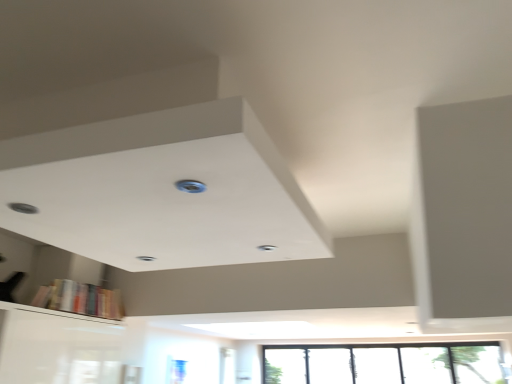
Image resolution: width=512 pixels, height=384 pixels. Find the location of `transparent glass window at lower right`. transparent glass window at lower right is located at coordinates (385, 363).

Identify the location of hardcover books at lower left. (80, 299).

You are a GUI agent. You are given a task and a screenshot of the screen. Output one action in this format:
    pyautogui.click(x=<x>, y=<y>)
    Task: Click on the blue plastic hole at center
    
    Given the screenshot: What is the action you would take?
    pyautogui.click(x=190, y=186)

In the scene shown: Is hardcover books at lower left in contact with blue plastic hole at center?

They are not placed beside each other.

From their relative heights in the image, would you say hardcover books at lower left is taller or shorter than blue plastic hole at center?

In the image, hardcover books at lower left appears to be taller than blue plastic hole at center.

Do you think hardcover books at lower left is within blue plastic hole at center, or outside of it?

hardcover books at lower left cannot be found inside blue plastic hole at center.

Find the location of a particular element. The image size is (512, 384). hole in front of the hardcover books at lower left is located at coordinates (190, 186).

From the image's perspective, which object appears higher, blue plastic hole at center or hardcover books at lower left?

blue plastic hole at center, from the image's perspective.

Between blue plastic hole at center and hardcover books at lower left, which one is positioned in front?

blue plastic hole at center.

From their relative heights in the image, would you say blue plastic hole at center is taller or shorter than hardcover books at lower left?

Considering their sizes, blue plastic hole at center has less height than hardcover books at lower left.

Is blue plastic hole at center not close to hardcover books at lower left?

Yes, blue plastic hole at center and hardcover books at lower left are located far from each other.

Are blue plastic hole at center and transparent glass window at lower right making contact?

No, blue plastic hole at center is not in contact with transparent glass window at lower right.

Does blue plastic hole at center have a greater width compared to transparent glass window at lower right?

Yes.

Is blue plastic hole at center positioned with its back to transparent glass window at lower right?

No, blue plastic hole at center is not facing the opposite direction of transparent glass window at lower right.

Which object is closer to the camera taking this photo, transparent glass window at lower right or hardcover books at lower left?

hardcover books at lower left is more forward.

Is there a large distance between transparent glass window at lower right and hardcover books at lower left?

That's right, there is a large distance between transparent glass window at lower right and hardcover books at lower left.

From the picture: Is transparent glass window at lower right spatially inside hardcover books at lower left, or outside of it?

transparent glass window at lower right exists outside the volume of hardcover books at lower left.

Which point is more distant from viewer, (369, 368) or (99, 310)?

The point (369, 368) is more distant.

Is hardcover books at lower left at the right side of transparent glass window at lower right?

No, hardcover books at lower left is not to the right of transparent glass window at lower right.

Can transparent glass window at lower right be found inside hardcover books at lower left?

No, hardcover books at lower left does not contain transparent glass window at lower right.

Find the location of `book above the transparent glass window at lower right (from the image's perspective)`. book above the transparent glass window at lower right (from the image's perspective) is located at coordinates (80, 299).

Considering the relative sizes of transparent glass window at lower right and blue plastic hole at center in the image provided, is transparent glass window at lower right taller than blue plastic hole at center?

Yes, transparent glass window at lower right is taller than blue plastic hole at center.

Based on the photo, which is nearer, (288, 372) or (193, 182)?

Clearly, point (288, 372) is more distant from the camera than point (193, 182).

Is transparent glass window at lower right thinner than blue plastic hole at center?

Yes, transparent glass window at lower right is thinner than blue plastic hole at center.

Consider the image. Is transparent glass window at lower right facing away from blue plastic hole at center?

No.

Locate an element on the screen. hole above the hardcover books at lower left (from the image's perspective) is located at coordinates (190, 186).

Where is `hole on the right of hardcover books at lower left`? This screenshot has height=384, width=512. hole on the right of hardcover books at lower left is located at coordinates (190, 186).

Looking at the image, which one is located further to blue plastic hole at center, transparent glass window at lower right or hardcover books at lower left?

Among the two, transparent glass window at lower right is located further to blue plastic hole at center.

Looking at this image, looking at the image, which one is located further to hardcover books at lower left, transparent glass window at lower right or blue plastic hole at center?

Based on the image, blue plastic hole at center appears to be further to hardcover books at lower left.

Estimate the real-world distances between objects in this image. Which object is closer to transparent glass window at lower right, blue plastic hole at center or hardcover books at lower left?

hardcover books at lower left is positioned closer to the anchor transparent glass window at lower right.

When comparing their distances from transparent glass window at lower right, does hardcover books at lower left or blue plastic hole at center seem further?

blue plastic hole at center is further to transparent glass window at lower right.

Estimate the real-world distances between objects in this image. Which object is further from hardcover books at lower left, blue plastic hole at center or transparent glass window at lower right?

The object further to hardcover books at lower left is blue plastic hole at center.

Consider the image. Estimate the real-world distances between objects in this image. Which object is closer to blue plastic hole at center, hardcover books at lower left or transparent glass window at lower right?

hardcover books at lower left is closer to blue plastic hole at center.

What are the coordinates of `book between blue plastic hole at center and transparent glass window at lower right along the z-axis` in the screenshot? It's located at (80, 299).